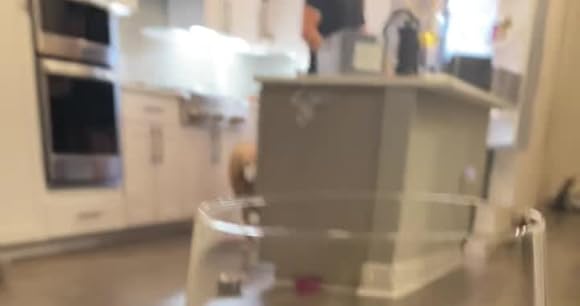
Image resolution: width=580 pixels, height=306 pixels. What are the coordinates of `top oven` in the screenshot? It's located at (86, 22).